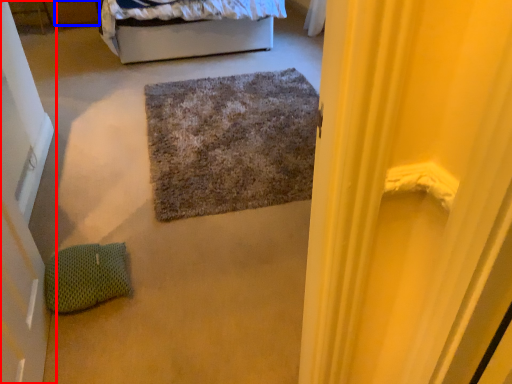
Question: Which of the following is the farthest to the observer, door (highlighted by a red box) or drawer (highlighted by a blue box)?

Choices:
 (A) door
 (B) drawer

Answer: (B)